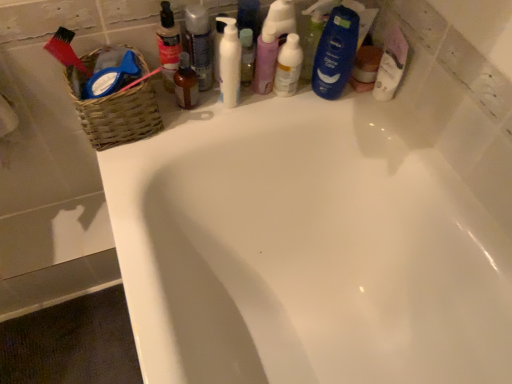
Question: Relative to white matte pump bottle at upper center, is translucent plastic bottle at upper center, the 5th toiletry in the right-to-left sequence, in front or behind?

Choices:
 (A) behind
 (B) front

Answer: (A)

Question: Considering the positions of translucent plastic bottle at upper center, which is the 1th toiletry in left-to-right order, and white matte pump bottle at upper center in the image, is translucent plastic bottle at upper center, which is the 1th toiletry in left-to-right order, taller or shorter than white matte pump bottle at upper center?

Choices:
 (A) tall
 (B) short

Answer: (B)

Question: Which object is the closest to the white matte pump bottle at upper center?

Choices:
 (A) translucent plastic bottle at upper center, positioned as the 3th toiletry in right-to-left order
 (B) purple matte lotion at center, which is the 4th toiletry in left-to-right order
 (C) blue glossy shampoo bottle at upper right, the 1th toiletry viewed from the right
 (D) woven brown basket at upper left
 (E) translucent plastic bottle at upper center, the 5th toiletry in the right-to-left sequence

Answer: (A)

Question: Which object is the farthest from the woven brown basket at upper left?

Choices:
 (A) white glossy bottle at upper center
 (B) brown glass bottle at upper center, the second toiletry from the left
 (C) translucent plastic bottle at upper center, the 5th toiletry in the right-to-left sequence
 (D) blue glossy shampoo bottle at upper right, which ranks as the fifth toiletry in left-to-right order
 (E) white glossy bathtub at upper center

Answer: (D)